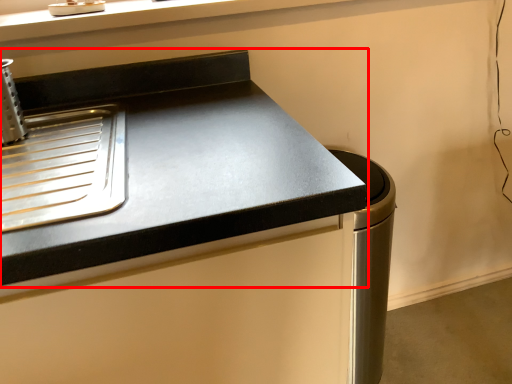
Question: Where is countertop (annotated by the red box) located in relation to appliance in the image?

Choices:
 (A) right
 (B) left

Answer: (B)